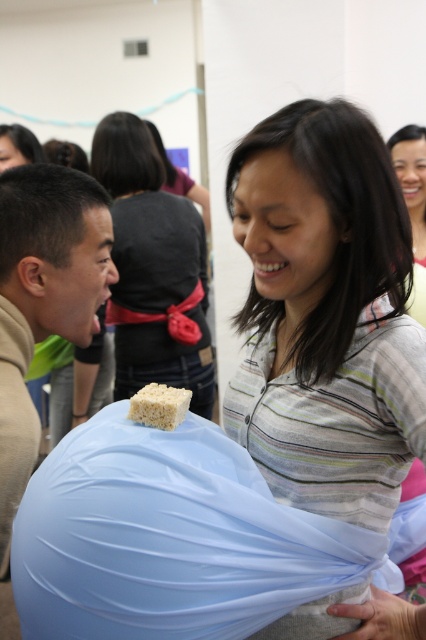
What do you see at coordinates (43, 298) in the screenshot? Image resolution: width=426 pixels, height=640 pixels. I see `matte beige shirt at left` at bounding box center [43, 298].

Who is more distant from viewer, (49,262) or (28,141)?

The point (28,141) is behind.

Between point (28, 326) and point (31, 157), which one is positioned behind?

The point (31, 157) is behind.

Identify the location of matte beige shirt at left. [43, 298].

Can you confirm if matte white rice cake at center is positioned to the right of matte black hair at upper left?

Correct, you'll find matte white rice cake at center to the right of matte black hair at upper left.

Is point (207, 330) more distant than point (6, 168)?

Yes, point (207, 330) is behind point (6, 168).

Locate an element on the screen. matte white rice cake at center is located at coordinates (154, 268).

Does striped cotton shirt at center have a larger size compared to matte black hair at upper left?

Yes, striped cotton shirt at center is bigger than matte black hair at upper left.

Who is positioned more to the right, striped cotton shirt at center or matte black hair at upper left?

striped cotton shirt at center

Identify the location of striped cotton shirt at center. Image resolution: width=426 pixels, height=640 pixels. (325, 314).

The width and height of the screenshot is (426, 640). What are the coordinates of `striped cotton shirt at center` in the screenshot? It's located at (325, 314).